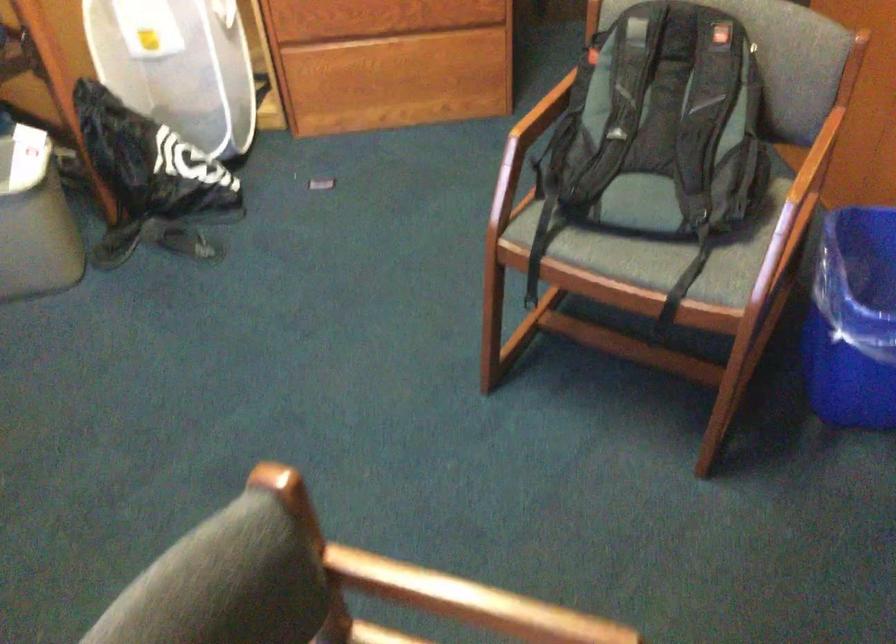
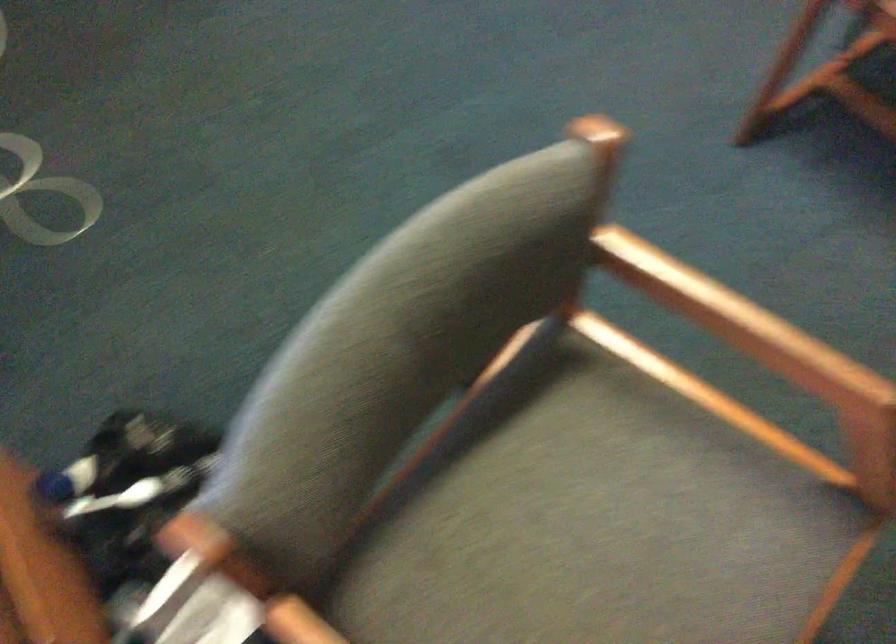
Question: Based on the continuous images, in which direction is the camera rotating? Reply with the corresponding letter.

Choices:
 (A) Left
 (B) Right
 (C) Up
 (D) Down

Answer: (D)